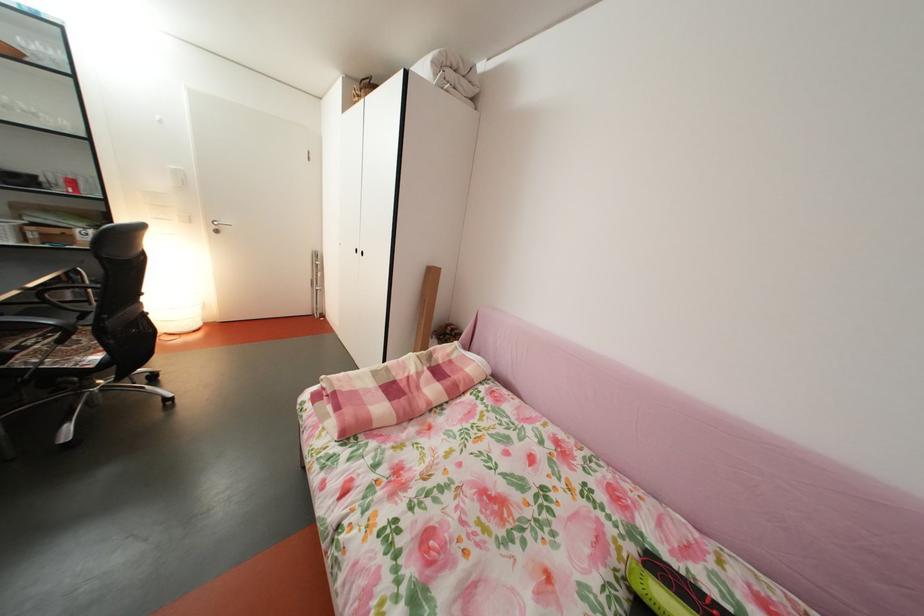
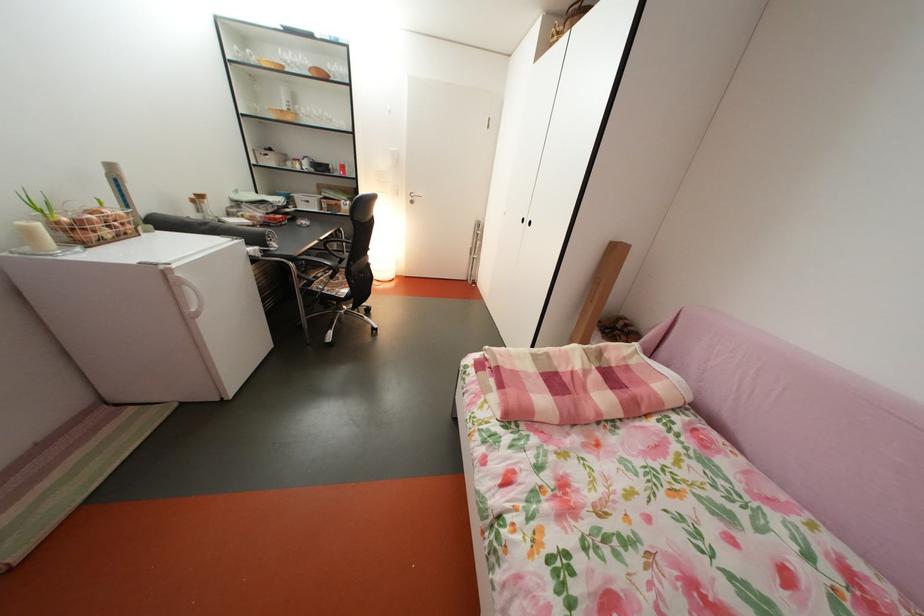
Question: The first image is from the beginning of the video and the second image is from the end. How did the camera likely rotate when shooting the video?

Choices:
 (A) Left
 (B) Right
 (C) Up
 (D) Down

Answer: (A)